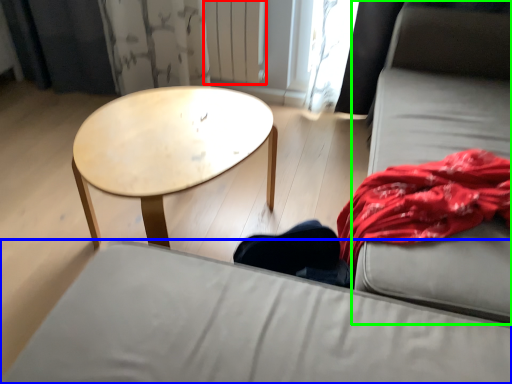
Question: Considering the real-world distances, which object is closest to radiator (highlighted by a red box)? studio couch (highlighted by a blue box) or couch (highlighted by a green box).

Choices:
 (A) studio couch
 (B) couch

Answer: (B)